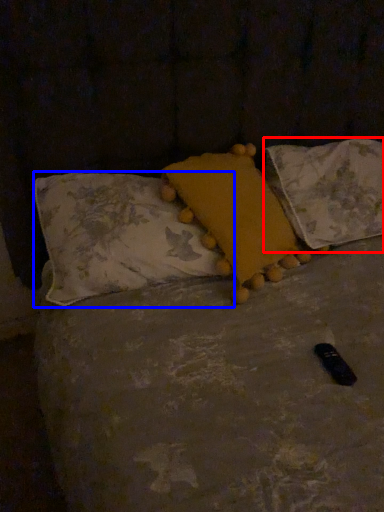
Question: Among these objects, which one is nearest to the camera, pillow (highlighted by a red box) or pillow (highlighted by a blue box)?

Choices:
 (A) pillow
 (B) pillow

Answer: (B)